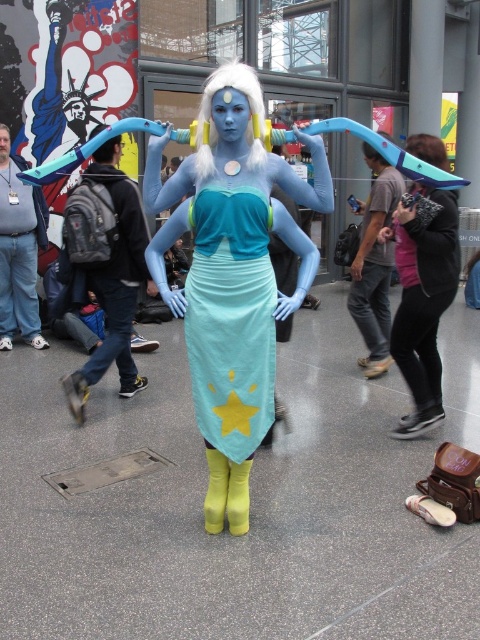
Does point (228, 390) come behind point (216, 76)?

Yes, it is behind point (216, 76).

Is light blue satin dress at center bigger than white synthetic wig at center?

Correct, light blue satin dress at center is larger in size than white synthetic wig at center.

At what (x,y) coordinates should I click in order to perform the action: click on light blue satin dress at center. Please return your answer as a coordinate pair (x, y). Looking at the image, I should click on (230, 320).

In the scene shown: Does black leather jacket at right have a greater height compared to brushed metal water at bottle left?

In fact, black leather jacket at right may be shorter than brushed metal water at bottle left.

Can you confirm if black leather jacket at right is positioned to the left of brushed metal water at bottle left?

In fact, black leather jacket at right is to the right of brushed metal water at bottle left.

Describe the element at coordinates (422, 301) in the screenshot. I see `black leather jacket at right` at that location.

I want to click on black leather jacket at right, so click(422, 301).

Is light blue satin dress at center above brushed metal water at bottle left?

No, light blue satin dress at center is not above brushed metal water at bottle left.

Which is in front, point (230, 401) or point (16, 294)?

Point (230, 401) is more forward.

Locate an element on the screen. The height and width of the screenshot is (640, 480). light blue satin dress at center is located at coordinates (230, 320).